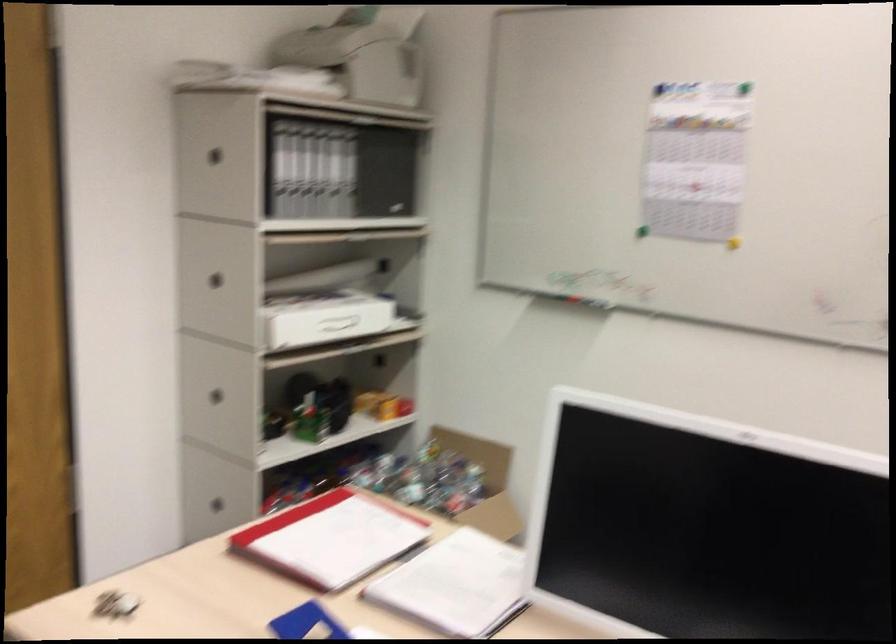
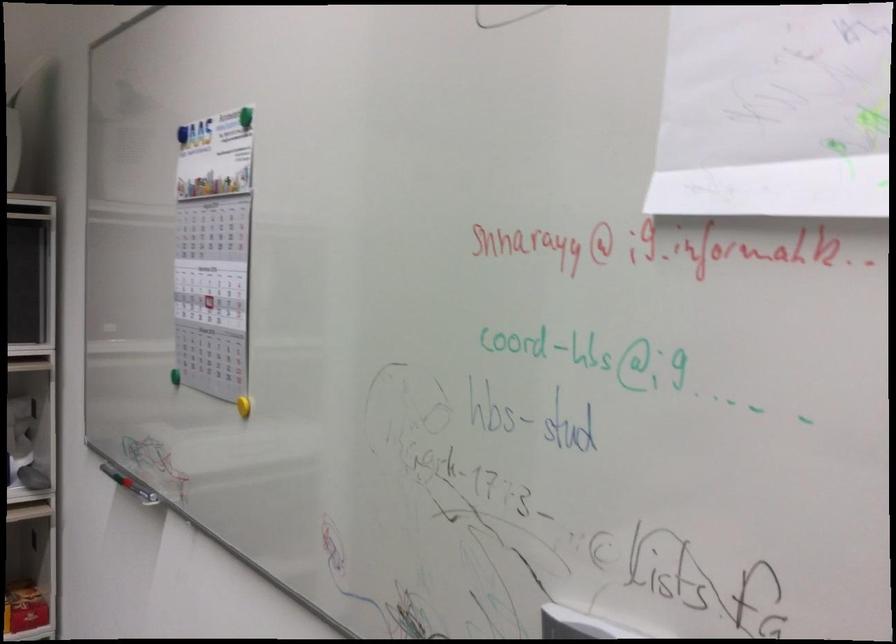
What movement of the cameraman would produce the second image?

The cameraman walked toward right, forward.